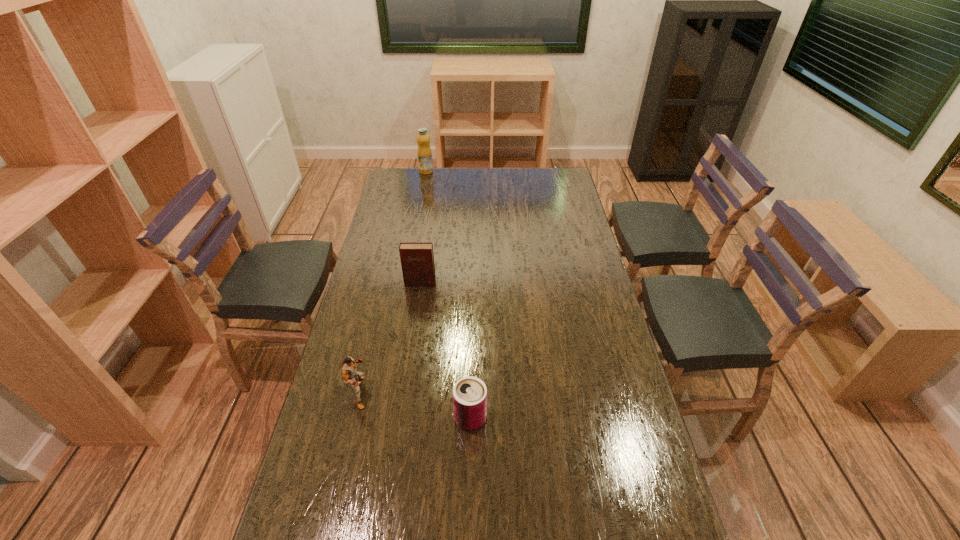
You are a GUI agent. You are given a task and a screenshot of the screen. Output one action in this format:
    pyautogui.click(x=<x>, y=<y>)
    Task: Click on the tallest object
    
    Given the screenshot: What is the action you would take?
    pyautogui.click(x=424, y=152)

Find the location of `the farthest object`. the farthest object is located at coordinates (424, 152).

Where is `diary`? diary is located at coordinates (417, 259).

Find the location of a particular element. Image resolution: width=960 pixels, height=540 pixels. the leftmost object is located at coordinates (348, 367).

Find the location of a particular element. This screenshot has width=960, height=540. the rightmost object is located at coordinates (469, 393).

The width and height of the screenshot is (960, 540). Find the location of `free space located 0.190m on the front label of the farthest object`. free space located 0.190m on the front label of the farthest object is located at coordinates (421, 195).

The image size is (960, 540). What are the coordinates of `free space located 0.220m on the front cover of the second farthest object` in the screenshot? It's located at (413, 333).

Identify the location of vacant space located 0.350m on the front-facing side of the leftmost object. The image size is (960, 540). (492, 393).

The image size is (960, 540). I want to click on free region located on the right of the rightmost object, so click(538, 418).

Where is `object present at the far edge`? object present at the far edge is located at coordinates (424, 152).